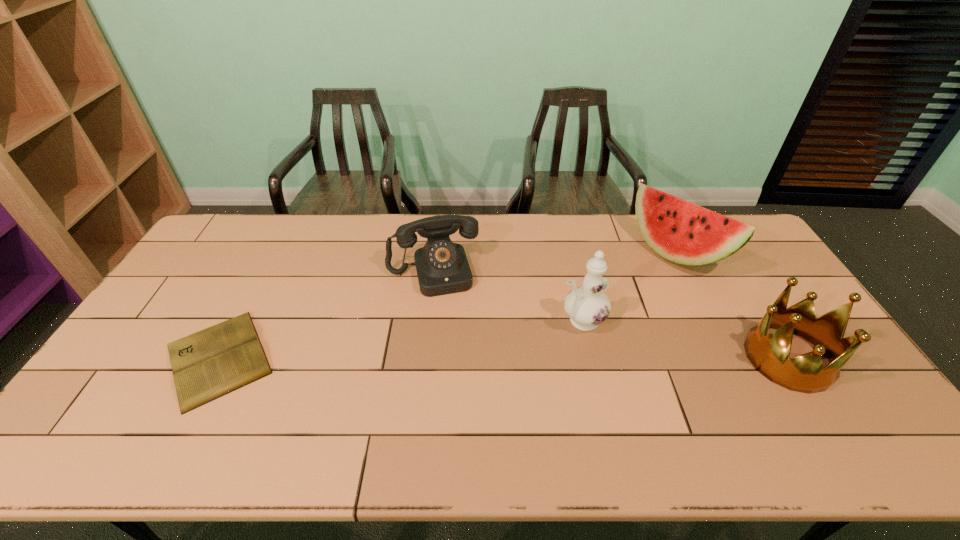
Where is `free space between the crown and the third object from left to right`? free space between the crown and the third object from left to right is located at coordinates (684, 339).

The height and width of the screenshot is (540, 960). Find the location of `vacant area between the shortest object and the second shortest object`. vacant area between the shortest object and the second shortest object is located at coordinates (325, 315).

At what (x,y) coordinates should I click in order to perform the action: click on free space between the telephone and the crown. Please return your answer as a coordinate pair (x, y). This screenshot has width=960, height=540. Looking at the image, I should click on (611, 315).

Where is `vacant area between the crown and the fourth object from right to left`? vacant area between the crown and the fourth object from right to left is located at coordinates [x=611, y=315].

Choose which object is the nearest neighbor to the watermelon. Please provide its 2D coordinates. Your answer should be formatted as a tuple, i.e. [(x, y)], where the tuple contains the x and y coordinates of a point satisfying the conditions above.

[(769, 354)]

Identify which object is located as the nearest to the book. Please provide its 2D coordinates. Your answer should be formatted as a tuple, i.e. [(x, y)], where the tuple contains the x and y coordinates of a point satisfying the conditions above.

[(442, 267)]

Locate an element on the screen. vacant space that satisfies the following two spatial constraints: 1. on the back side of the crown; 2. on the right side of the leftmost object is located at coordinates (219, 358).